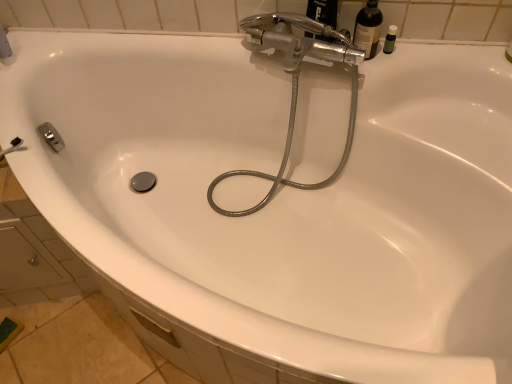
What do you see at coordinates (390, 39) in the screenshot?
I see `green plastic bottle at upper right` at bounding box center [390, 39].

Image resolution: width=512 pixels, height=384 pixels. I want to click on translucent glass bottle at upper right, so click(x=368, y=29).

Between point (388, 37) and point (355, 46), which one is positioned behind?

Point (388, 37)

Is green plastic bottle at upper right shorter than metallic hose at center?

Correct, green plastic bottle at upper right is not as tall as metallic hose at center.

Which object is positioned more to the left, green plastic bottle at upper right or metallic hose at center?

From the viewer's perspective, metallic hose at center appears more on the left side.

Is the position of green plastic bottle at upper right more distant than that of metallic hose at center?

Yes, green plastic bottle at upper right is behind metallic hose at center.

Is metallic hose at center bigger than green plastic bottle at upper right?

Yes, metallic hose at center is bigger than green plastic bottle at upper right.

This screenshot has height=384, width=512. In order to click on toiletry behind the metallic hose at center in this screenshot , I will do `click(390, 39)`.

Is point (281, 179) closer or farther from the camera than point (395, 40)?

Point (281, 179) is farther from the camera than point (395, 40).

What's the angular difference between metallic hose at center and translucent glass bottle at upper right's facing directions?

They differ by 5.01 degrees in their facing directions.

Is point (292, 134) positioned in front of point (374, 32)?

No, (292, 134) is behind (374, 32).

Can you confirm if metallic hose at center is smaller than translucent glass bottle at upper right?

Incorrect, metallic hose at center is not smaller in size than translucent glass bottle at upper right.

Which of these two, metallic hose at center or translucent glass bottle at upper right, stands taller?

Standing taller between the two is metallic hose at center.

Is point (361, 16) less distant than point (338, 175)?

Yes, it is.

From the image's perspective, would you say translucent glass bottle at upper right is shown under metallic hose at center?

Actually, translucent glass bottle at upper right appears above metallic hose at center in the image.

From the picture: Does translucent glass bottle at upper right touch metallic hose at center?

No, translucent glass bottle at upper right is not with metallic hose at center.

How many degrees apart are the facing directions of translucent glass bottle at upper right and metallic hose at center?

5.01 degrees separate the facing orientations of translucent glass bottle at upper right and metallic hose at center.

Which is farther, [372,37] or [388,31]?

The point [388,31] is more distant.

From the image's perspective, which is above, translucent glass bottle at upper right or green plastic bottle at upper right?

translucent glass bottle at upper right appears higher in the image.

Is translucent glass bottle at upper right oriented away from green plastic bottle at upper right?

No, green plastic bottle at upper right is not at the back of translucent glass bottle at upper right.

Is green plastic bottle at upper right bigger than translucent glass bottle at upper right?

Actually, green plastic bottle at upper right might be smaller than translucent glass bottle at upper right.

From the image's perspective, is green plastic bottle at upper right above translucent glass bottle at upper right?

No.

From a real-world perspective, is green plastic bottle at upper right beneath translucent glass bottle at upper right?

Yes, from a real-world perspective, green plastic bottle at upper right is below translucent glass bottle at upper right.

I want to click on toiletry that appears on the right of metallic hose at center, so click(390, 39).

Locate an element on the screen. This screenshot has width=512, height=384. plumbing fixture below the green plastic bottle at upper right (from the image's perspective) is located at coordinates (296, 86).

Looking at the image, which one is located further to metallic hose at center, green plastic bottle at upper right or translucent glass bottle at upper right?

The object further to metallic hose at center is green plastic bottle at upper right.

From the image, which object appears to be nearer to translucent glass bottle at upper right, green plastic bottle at upper right or metallic hose at center?

Among the two, green plastic bottle at upper right is located nearer to translucent glass bottle at upper right.

Considering their positions, is translucent glass bottle at upper right positioned further to metallic hose at center than green plastic bottle at upper right?

green plastic bottle at upper right.

Considering their positions, is metallic hose at center positioned further to green plastic bottle at upper right than translucent glass bottle at upper right?

Among the two, metallic hose at center is located further to green plastic bottle at upper right.

Based on the photo, estimate the real-world distances between objects in this image. Which object is closer to green plastic bottle at upper right, translucent glass bottle at upper right or metallic hose at center?

translucent glass bottle at upper right.

Considering their positions, is metallic hose at center positioned closer to translucent glass bottle at upper right than green plastic bottle at upper right?

green plastic bottle at upper right.

I want to click on bottle between metallic hose at center and green plastic bottle at upper right from left to right, so click(x=368, y=29).